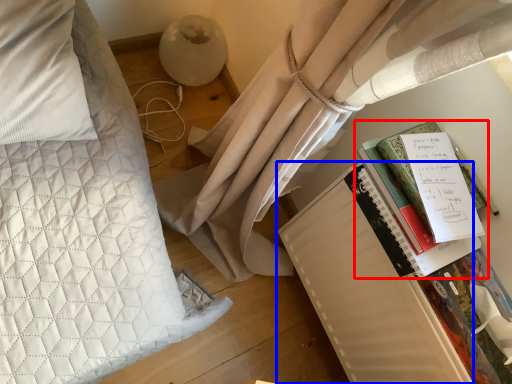
Question: Which object appears closest to the camera in this image, book (highlighted by a red box) or paperback book (highlighted by a blue box)?

Choices:
 (A) book
 (B) paperback book

Answer: (A)